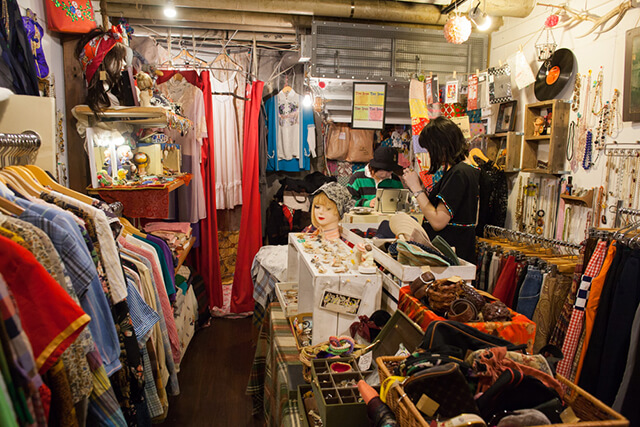
Where is `light`? The height and width of the screenshot is (427, 640). light is located at coordinates (173, 16).